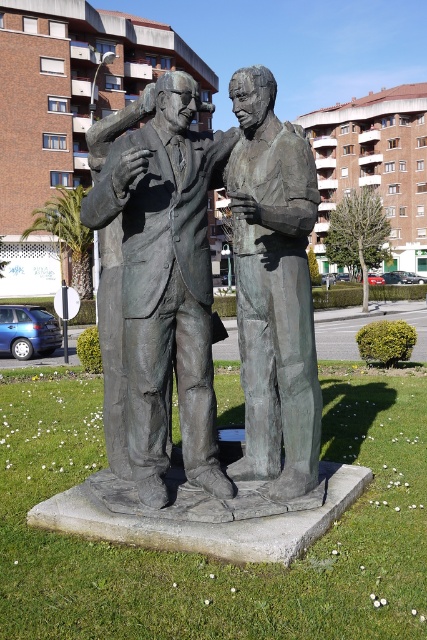
Between bronze statue at center and bronze statue of man at center, which one is positioned higher?

bronze statue of man at center

Does point (190, 182) come closer to viewer compared to point (271, 92)?

Yes, point (190, 182) is closer to viewer.

This screenshot has height=640, width=427. I want to click on bronze statue at center, so click(163, 276).